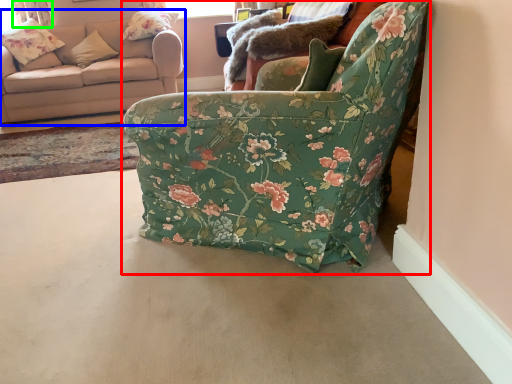
Question: Estimate the real-world distances between objects in this image. Which object is farther from chair (highlighted by a red box), studio couch (highlighted by a blue box) or curtain (highlighted by a green box)?

Choices:
 (A) studio couch
 (B) curtain

Answer: (B)